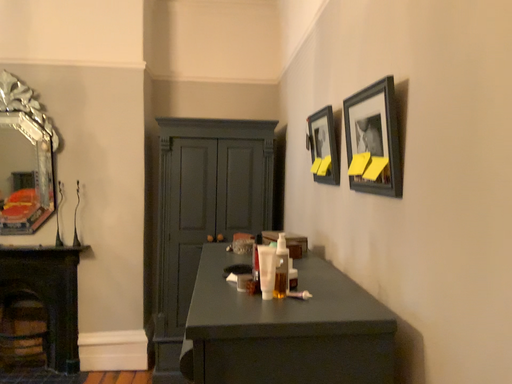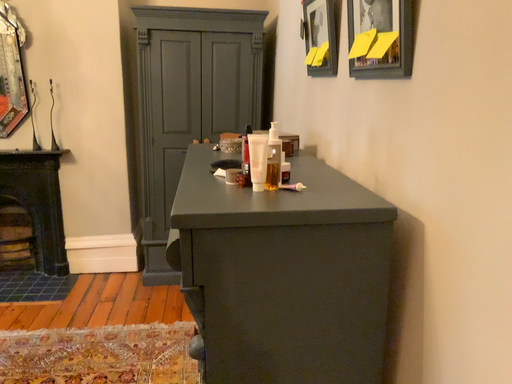
Question: How did the camera likely rotate when shooting the video?

Choices:
 (A) rotated upward
 (B) rotated downward

Answer: (B)